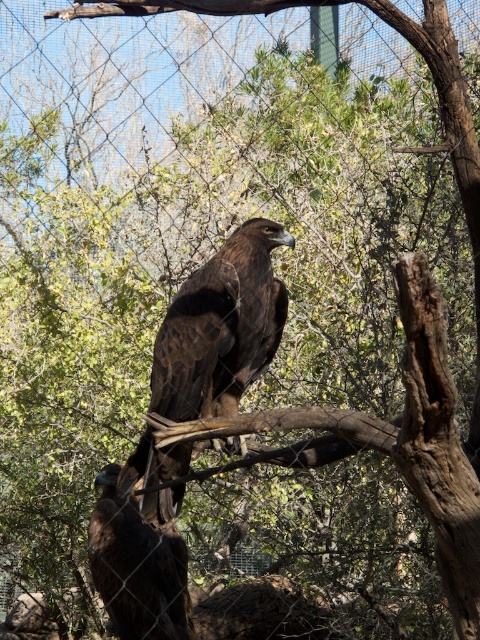
Does brown feathered eagle at center have a lesser height compared to dark brown feathers at center?

No.

Does point (271, 234) come behind point (98, 547)?

No, (271, 234) is closer to viewer.

The height and width of the screenshot is (640, 480). What do you see at coordinates (220, 326) in the screenshot?
I see `brown feathered eagle at center` at bounding box center [220, 326].

Identify the location of brown feathered eagle at center. The height and width of the screenshot is (640, 480). (220, 326).